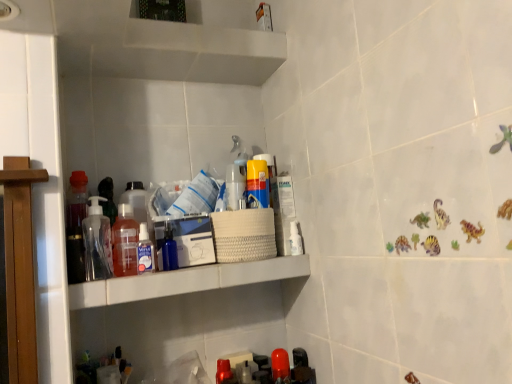
This screenshot has height=384, width=512. What are the coordinates of `free location to the left of white plastic bottle at upper right, the third toiletry from the left` in the screenshot? It's located at (246, 262).